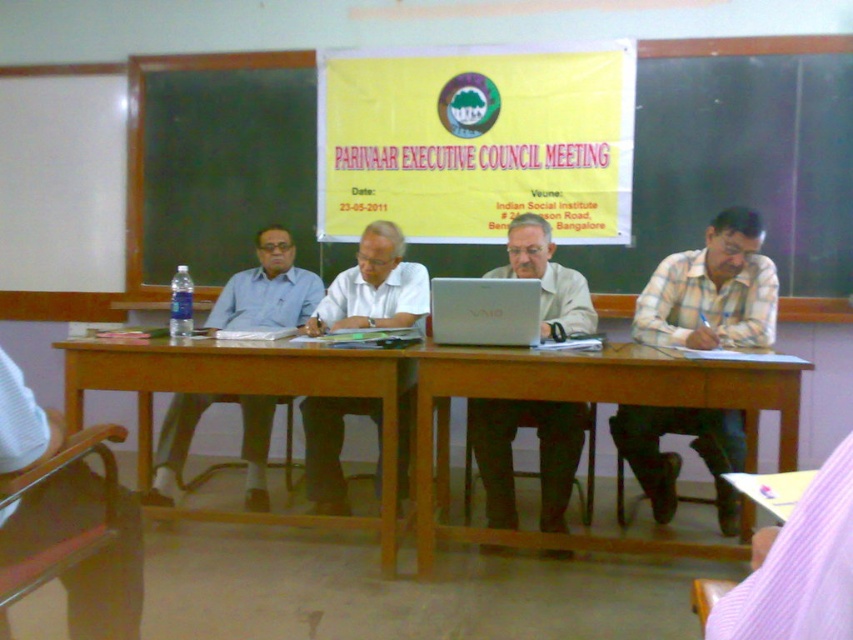
Is the position of wooden table at center more distant than that of white matte shirt at center?

No, it is not.

Who is taller, wooden table at center or white matte shirt at center?

Standing taller between the two is wooden table at center.

You are a GUI agent. You are given a task and a screenshot of the screen. Output one action in this format:
    pyautogui.click(x=<x>, y=<y>)
    Task: Click on the wooden table at center
    This screenshot has width=853, height=640.
    Given the screenshot: What is the action you would take?
    pyautogui.click(x=585, y=401)

In order to click on wooden table at center in this screenshot , I will do `click(585, 401)`.

Does wooden table at center have a lesser height compared to matte white laptop at center?

In fact, wooden table at center may be taller than matte white laptop at center.

In the scene shown: Is wooden table at center to the left of matte white laptop at center from the viewer's perspective?

No, wooden table at center is not to the left of matte white laptop at center.

Who is more distant from viewer, (x=699, y=378) or (x=515, y=257)?

Positioned behind is point (x=515, y=257).

What are the coordinates of `wooden table at center` in the screenshot? It's located at (585, 401).

Identify the location of brown wooden table at center. (242, 394).

Is brown wooden table at center bigger than purple striped shirt at lower right?

Indeed, brown wooden table at center has a larger size compared to purple striped shirt at lower right.

This screenshot has height=640, width=853. What do you see at coordinates (242, 394) in the screenshot?
I see `brown wooden table at center` at bounding box center [242, 394].

Locate an element on the screen. This screenshot has width=853, height=640. brown wooden table at center is located at coordinates (242, 394).